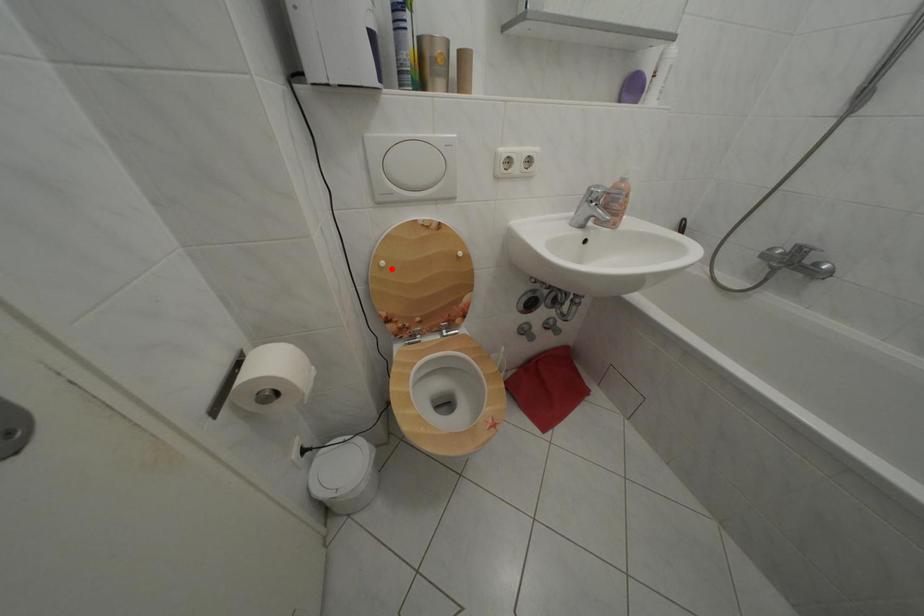
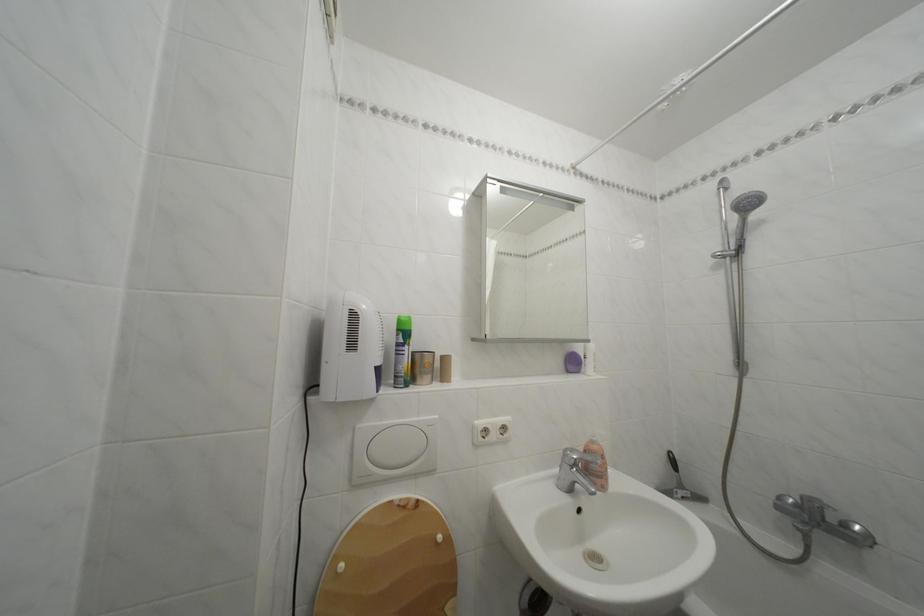
Question: I am providing you with two images of the same scene from different viewpoints. Image1 has a red point marked. In image2, the corresponding 3D location appears at what relative position? Reply with the corresponding letter.

Choices:
 (A) Closer
 (B) Farther

Answer: (B)